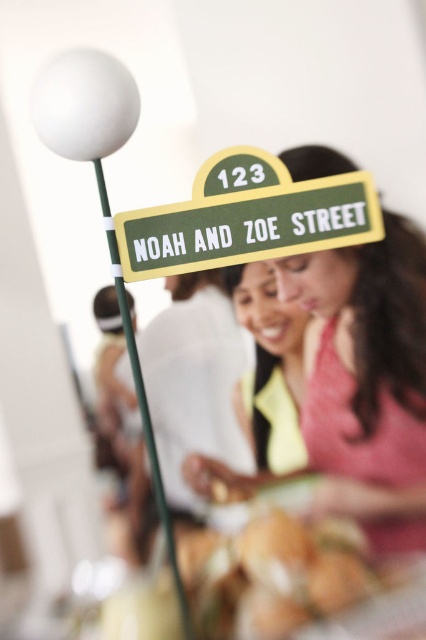
Can you confirm if green matte street sign at upper center is positioned below green matte street sign at center?

Indeed, green matte street sign at upper center is positioned under green matte street sign at center.

Can you confirm if green matte street sign at upper center is positioned to the right of green matte street sign at center?

Yes, green matte street sign at upper center is to the right of green matte street sign at center.

Describe the element at coordinates (365, 380) in the screenshot. I see `green matte street sign at upper center` at that location.

This screenshot has height=640, width=426. I want to click on green matte street sign at upper center, so click(x=365, y=380).